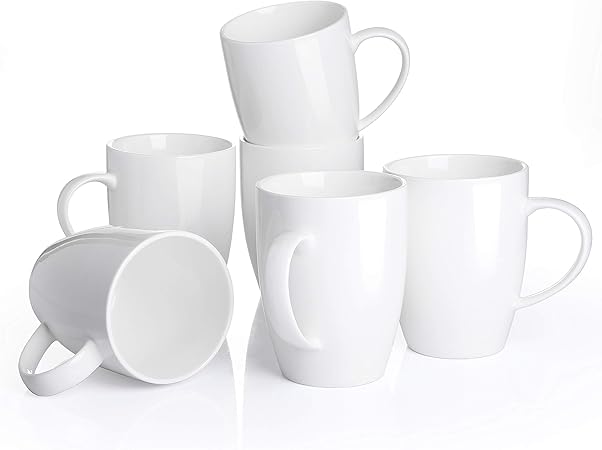
This screenshot has width=602, height=450. Identify the location of handles on mugs. (585, 258), (280, 307), (48, 376), (67, 209), (398, 88).